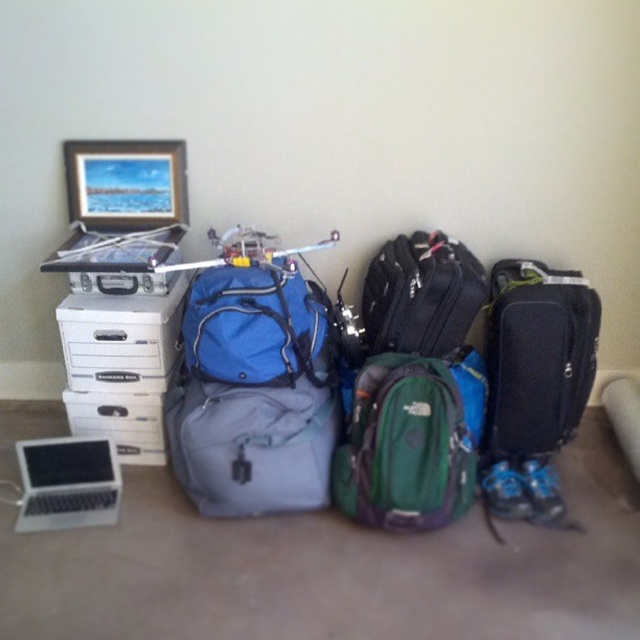
Question: Which point is closer to the camera?

Choices:
 (A) (150, 388)
 (B) (356, 492)
 (C) (141, 204)

Answer: (B)

Question: From the image, what is the correct spatial relationship of matte black backpack at center in relation to wooden frame at upper left?

Choices:
 (A) left
 (B) right

Answer: (B)

Question: Among these objects, which one is nearest to the camera?

Choices:
 (A) black textured suitcase at right
 (B) silver metallic laptop at lower left

Answer: (B)

Question: Which of the following is the closest to the observer?

Choices:
 (A) click(456, 333)
 (B) click(176, 358)
 (C) click(116, 490)
 (D) click(547, 291)

Answer: (D)

Question: Can you confirm if green fabric backpack at center is smaller than silver metallic laptop at lower left?

Choices:
 (A) no
 (B) yes

Answer: (A)

Question: Is matte black backpack at center bigger than wooden frame at upper left?

Choices:
 (A) no
 (B) yes

Answer: (B)